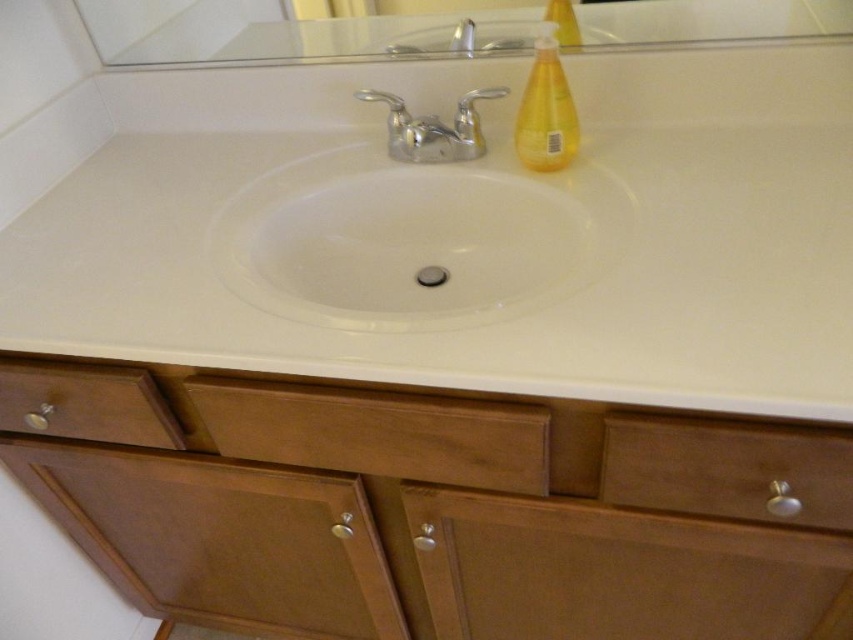
Question: Is clear glass mirror at upper center thinner than yellow translucent bottle at upper right?

Choices:
 (A) yes
 (B) no

Answer: (B)

Question: Which point appears farthest from the camera in this image?

Choices:
 (A) (432, 180)
 (B) (498, 536)
 (C) (399, 132)
 (D) (751, 481)

Answer: (C)

Question: Where is white laminate sink at center located in relation to wooden cabinet at lower center in the image?

Choices:
 (A) below
 (B) above

Answer: (B)

Question: Does white laminate sink at center appear over clear glass mirror at upper center?

Choices:
 (A) no
 (B) yes

Answer: (A)

Question: Which of the following is the farthest from the observer?

Choices:
 (A) (352, 616)
 (B) (445, 275)

Answer: (A)

Question: Which of the following is the farthest from the observer?

Choices:
 (A) wooden cabinet at lower center
 (B) wooden drawer at center

Answer: (B)